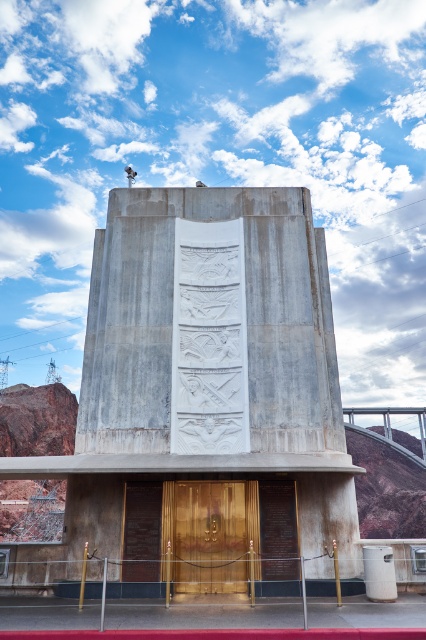
You are standing in front of the concreteroughmonument at lower center and the polished wood door at center. Which object is taller?

The polished wood door at center is taller than the concreteroughmonument at lower center.

You are an architect designing a new pathway that needs to pass between the concreteroughmonument at lower center and the polished wood door at center. Based on their sizes, which object should the pathway be closer to?

The pathway should be closer to the polished wood door at center because the concreteroughmonument at lower center might be wider than the door, requiring more space on its side.

You are standing in front of the monument and want to find the entrance. Which object should you approach first, the concreteroughmonument at lower center or the polished wood door at center?

The polished wood door at center is the entrance, so you should approach the polished wood door at center first.